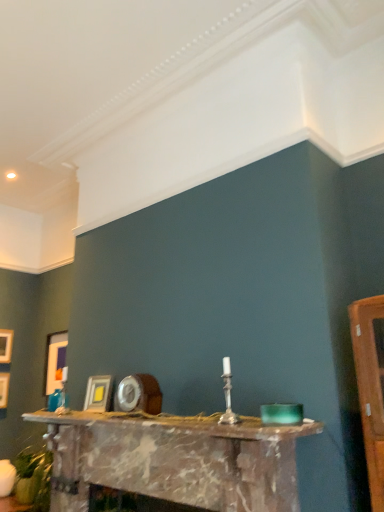
Question: Does point (91, 402) appear closer or farther from the camera than point (0, 342)?

Choices:
 (A) closer
 (B) farther

Answer: (A)

Question: Is matte gold picture frame at center, the 1th picture frame viewed from the front, wider or thinner than wooden picture frame at left, the fourth picture frame in the right-to-left sequence?

Choices:
 (A) wide
 (B) thin

Answer: (A)

Question: Which object is the farthest from the matte gold picture frame at center, the 1th picture frame viewed from the front?

Choices:
 (A) matte white picture frame at left, the 3th picture frame in the back-to-front sequence
 (B) wooden picture frame at left, which appears as the 1th picture frame when viewed from the back
 (C) marble fireplace at center
 (D) matte gold picture frame at left, which ranks as the second picture frame in back-to-front order

Answer: (B)

Question: Estimate the real-world distances between objects in this image. Which object is closer to the marble fireplace at center?

Choices:
 (A) matte gold picture frame at left, the third picture frame viewed from the front
 (B) matte white picture frame at left, the 3th picture frame in the back-to-front sequence
 (C) matte gold picture frame at center, the 1th picture frame from the right
 (D) wooden picture frame at left, the fourth picture frame in the right-to-left sequence

Answer: (C)